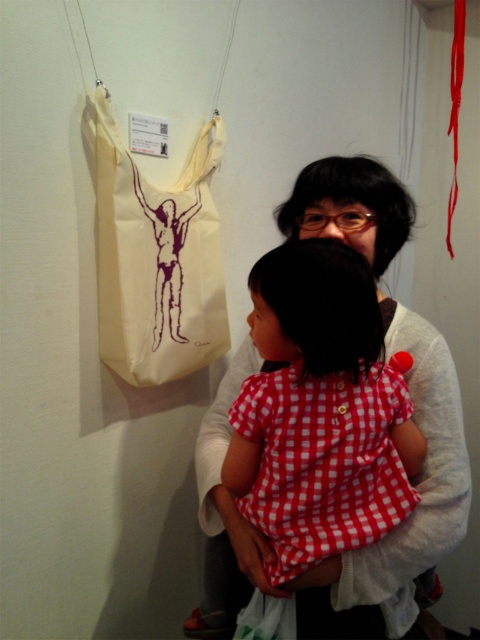
Question: Is matte white cotton bag at upper left positioned at the back of off-white canvas tote at left?

Choices:
 (A) no
 (B) yes

Answer: (A)

Question: Among these objects, which one is farthest from the camera?

Choices:
 (A) matte white cotton bag at upper left
 (B) off-white canvas tote at left

Answer: (B)

Question: Does matte white cotton bag at upper left have a smaller size compared to off-white canvas tote at left?

Choices:
 (A) yes
 (B) no

Answer: (B)

Question: Is matte white cotton bag at upper left to the left of off-white canvas tote at left from the viewer's perspective?

Choices:
 (A) no
 (B) yes

Answer: (A)

Question: Which point is closer to the camera taking this photo?

Choices:
 (A) (190, 211)
 (B) (355, 234)

Answer: (B)